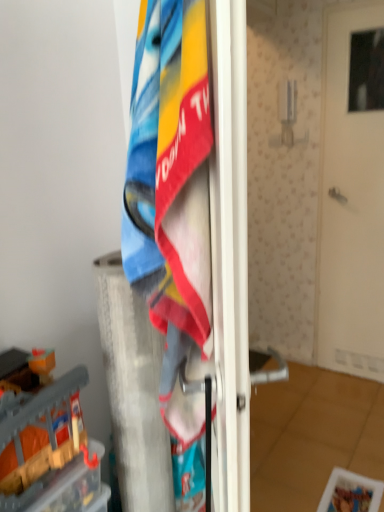
Where is `vacant space to the left of white matte door at center`? Image resolution: width=384 pixels, height=512 pixels. vacant space to the left of white matte door at center is located at coordinates (312, 381).